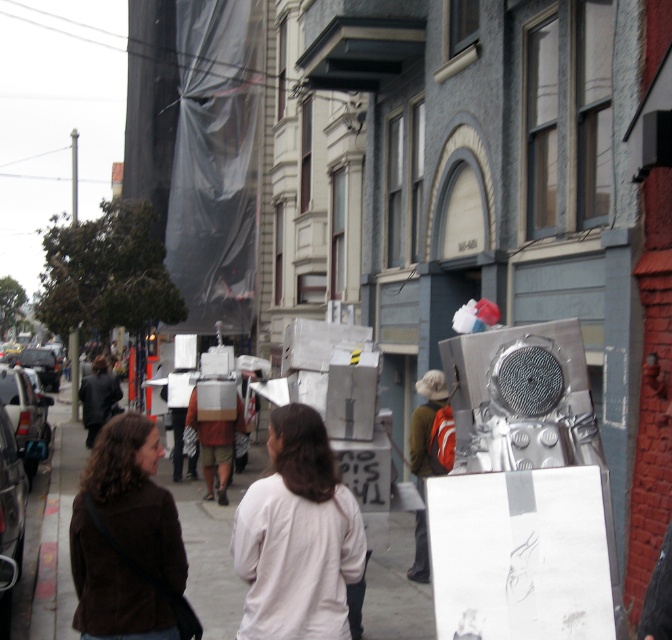
Between smooth concrete sidewalk at center and suede brown jacket at lower left, which one appears on the left side from the viewer's perspective?

smooth concrete sidewalk at center

Does smooth concrete sidewalk at center have a lesser width compared to suede brown jacket at lower left?

No.

At what (x,y) coordinates should I click in order to perform the action: click on smooth concrete sidewalk at center. Please return your answer as a coordinate pair (x, y). Image resolution: width=672 pixels, height=640 pixels. Looking at the image, I should click on (52, 532).

The height and width of the screenshot is (640, 672). Find the location of `smooth concrete sidewalk at center`. smooth concrete sidewalk at center is located at coordinates (52, 532).

Does smooth concrete sidewalk at center appear over white matte shirt at center?

Actually, smooth concrete sidewalk at center is below white matte shirt at center.

From the picture: Between smooth concrete sidewalk at center and white matte shirt at center, which one is positioned higher?

white matte shirt at center

The image size is (672, 640). Identify the location of smooth concrete sidewalk at center. (52, 532).

You are a GUI agent. You are given a task and a screenshot of the screen. Output one action in this format:
    pyautogui.click(x=<x>, y=<y>)
    Task: Click on the smooth concrete sidewalk at center
    The image size is (672, 640).
    Given the screenshot: What is the action you would take?
    pyautogui.click(x=52, y=532)

Does suede brown jacket at lower left have a larger size compared to metallic silver backpack at center?

Actually, suede brown jacket at lower left might be smaller than metallic silver backpack at center.

Is suede brown jacket at lower left closer to the viewer compared to metallic silver backpack at center?

Yes, it is in front of metallic silver backpack at center.

Does point (120, 525) lie behind point (425, 435)?

That is False.

Find the location of a particular element. This screenshot has height=640, width=672. suede brown jacket at lower left is located at coordinates (126, 538).